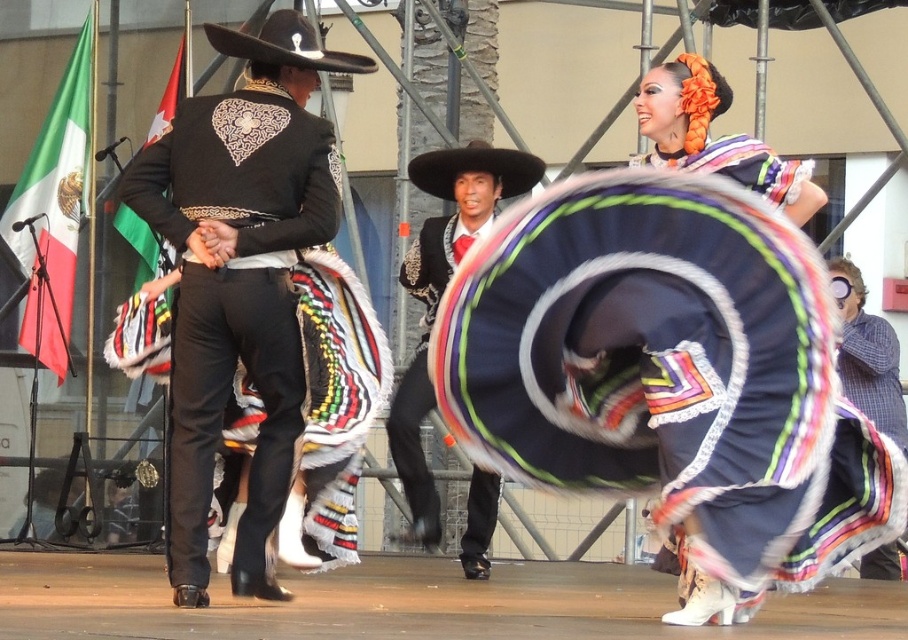
You are standing in the audience watching the performance. You want to take a photo of the velvet dark blue sombrero at center. Considering the distance, can you capture it clearly with your smartphone camera?

The velvet dark blue sombrero at center is 63.34 feet from viewer. Since smartphone cameras typically have difficulty focusing beyond 50 feet, it might be challenging to capture it clearly. You might need to use zoom or move closer.